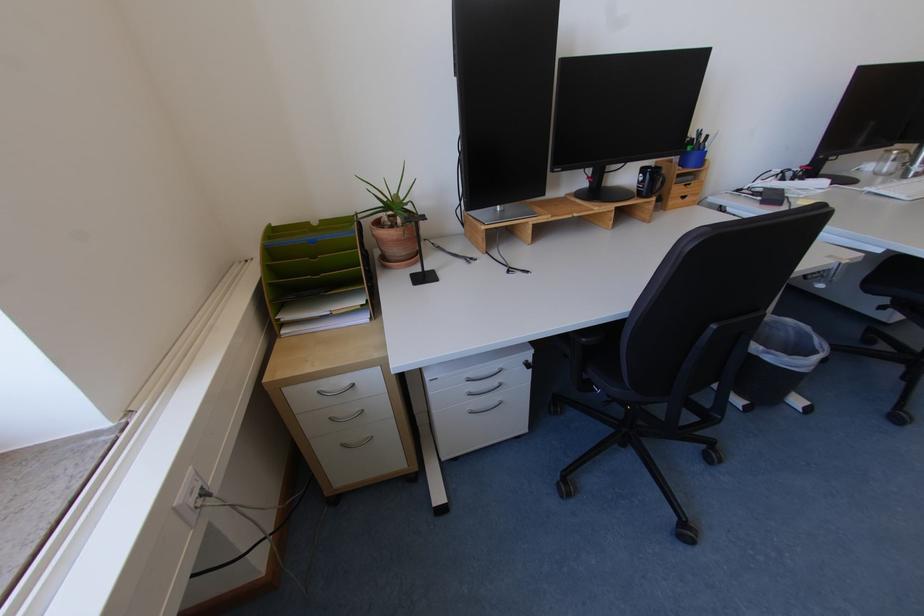
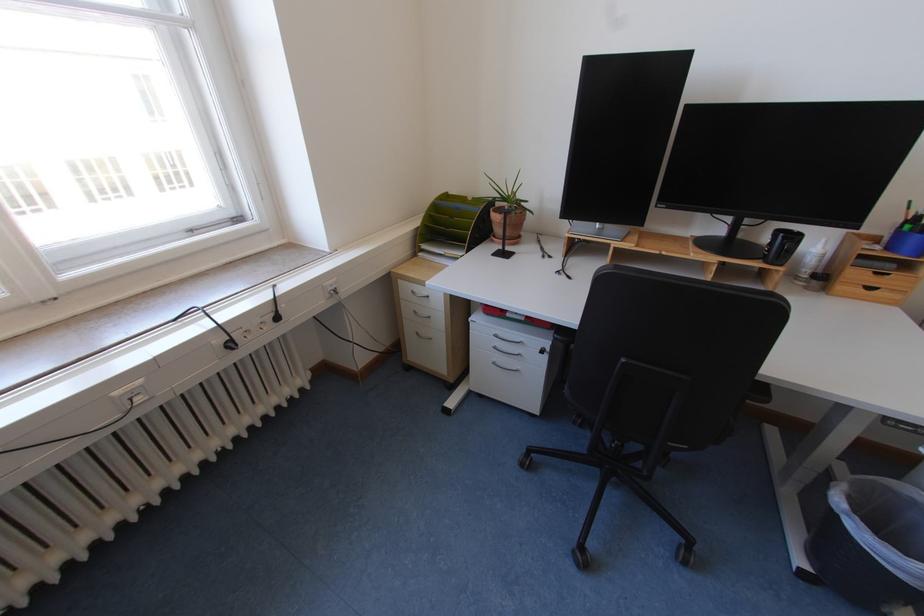
The point at (643, 199) is marked in the first image. Where is the corresponding point in the second image?

(769, 262)